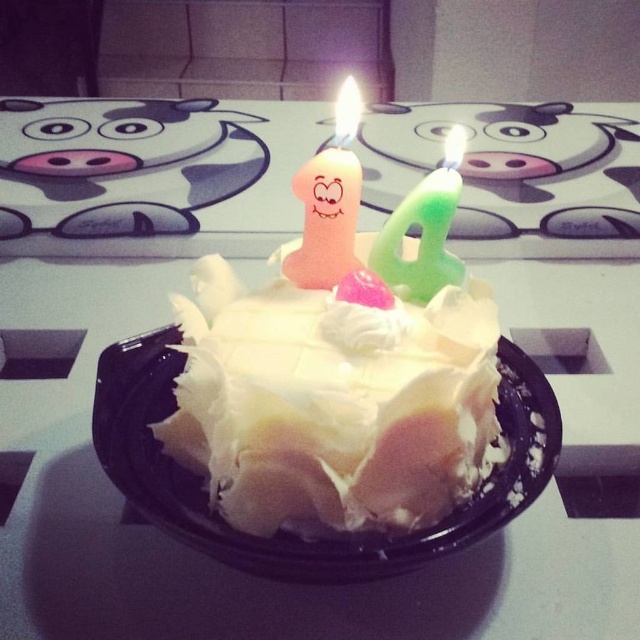
Question: Is white matte plate at center smaller than green matte candle at center?

Choices:
 (A) no
 (B) yes

Answer: (A)

Question: Among these objects, which one is farthest from the camera?

Choices:
 (A) green matte candle at center
 (B) pink matte candle at center

Answer: (B)

Question: Which point appears closest to the camera in this image?

Choices:
 (A) (140, 342)
 (B) (400, 268)

Answer: (A)

Question: In this image, where is white matte plate at center located relative to green matte candle at center?

Choices:
 (A) left
 (B) right

Answer: (A)

Question: Is white frosted cake at center to the left of white matte plate at center from the viewer's perspective?

Choices:
 (A) yes
 (B) no

Answer: (B)

Question: Which point is farther to the camera?

Choices:
 (A) (400, 248)
 (B) (468, 534)
 (C) (445, 458)
 (D) (310, 208)

Answer: (A)